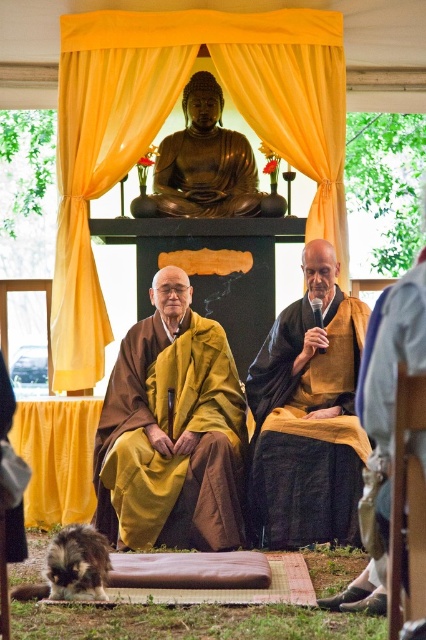
Which is above, gold polished statue at center or brown textured robe at lower right?

gold polished statue at center is higher up.

Does gold polished statue at center appear over brown textured robe at lower right?

Yes, gold polished statue at center is above brown textured robe at lower right.

Which is in front, point (166, 170) or point (377, 493)?

Positioned in front is point (377, 493).

Identify the location of gold polished statue at center. (204, 161).

Can you confirm if brown matte robe at center is taller than gold polished statue at center?

Indeed, brown matte robe at center has a greater height compared to gold polished statue at center.

Measure the distance from brown matte robe at center to gold polished statue at center.

brown matte robe at center and gold polished statue at center are 71.68 feet apart from each other.

What do you see at coordinates (383, 422) in the screenshot? I see `brown matte robe at center` at bounding box center [383, 422].

Where is `brown matte robe at center`? This screenshot has height=640, width=426. brown matte robe at center is located at coordinates pos(383,422).

Between point (342, 593) and point (408, 355), which one is positioned in front?

Point (408, 355) is in front.

Is brown matte robe at center further to the viewer compared to brown textured robe at lower right?

Yes, it is.

Between point (367, 378) and point (409, 369), which one is positioned behind?

Positioned behind is point (367, 378).

Find the location of a particular element. The height and width of the screenshot is (640, 426). brown matte robe at center is located at coordinates (383, 422).